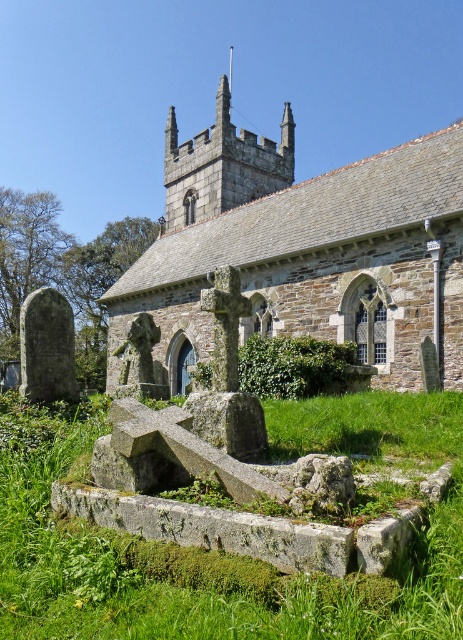
Can you confirm if stone church at center is positioned below green mossy stone at center?

Incorrect, stone church at center is not positioned below green mossy stone at center.

Who is higher up, stone church at center or green mossy stone at center?

stone church at center is higher up.

Does point (298, 189) come in front of point (341, 632)?

That is False.

What are the coordinates of `stone church at center` in the screenshot? It's located at (304, 248).